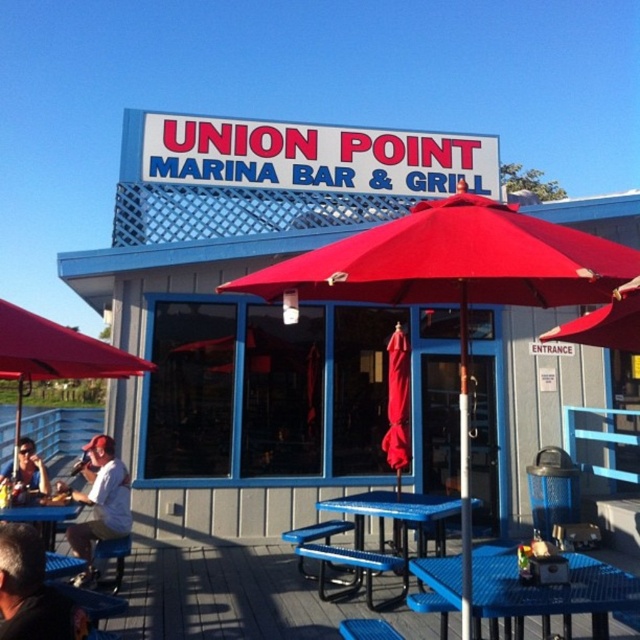
Question: Is gray hair at lower left smaller than white shirt at lower left?

Choices:
 (A) yes
 (B) no

Answer: (A)

Question: Which point appears farthest from the camera in this image?

Choices:
 (A) (397, 518)
 (B) (44, 541)
 (C) (566, 620)

Answer: (A)

Question: Is blue plastic table at lower right bigger than matte white shirt at lower left?

Choices:
 (A) no
 (B) yes

Answer: (B)

Question: Is blue plastic table at lower right to the left of white shirt at lower left from the viewer's perspective?

Choices:
 (A) no
 (B) yes

Answer: (A)

Question: Which point appears closest to the camera in this image?

Choices:
 (A) (86, 346)
 (B) (572, 564)
 (C) (49, 483)
 (D) (24, 625)

Answer: (D)

Question: Which point is farther to the camera?

Choices:
 (A) (596, 292)
 (B) (88, 472)
 (C) (17, 520)

Answer: (B)